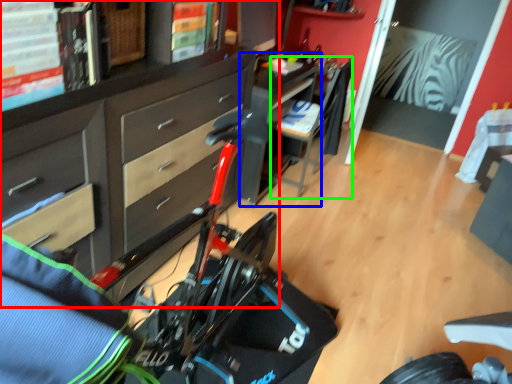
Question: Based on their relative distances, which object is nearer to cabinetry (highlighted by a red box)? Choose from table (highlighted by a blue box) and chair (highlighted by a green box).

Choices:
 (A) table
 (B) chair

Answer: (A)